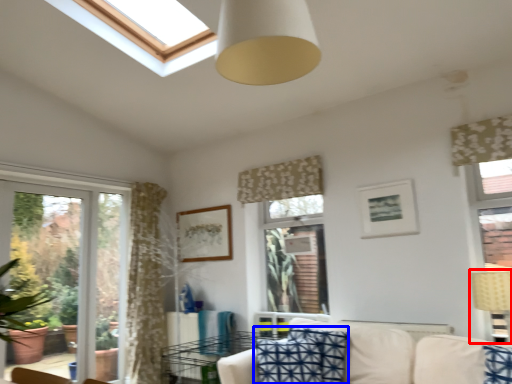
Question: Which point is further to the camera, table lamp (highlighted by a red box) or pillow (highlighted by a blue box)?

Choices:
 (A) table lamp
 (B) pillow

Answer: (B)